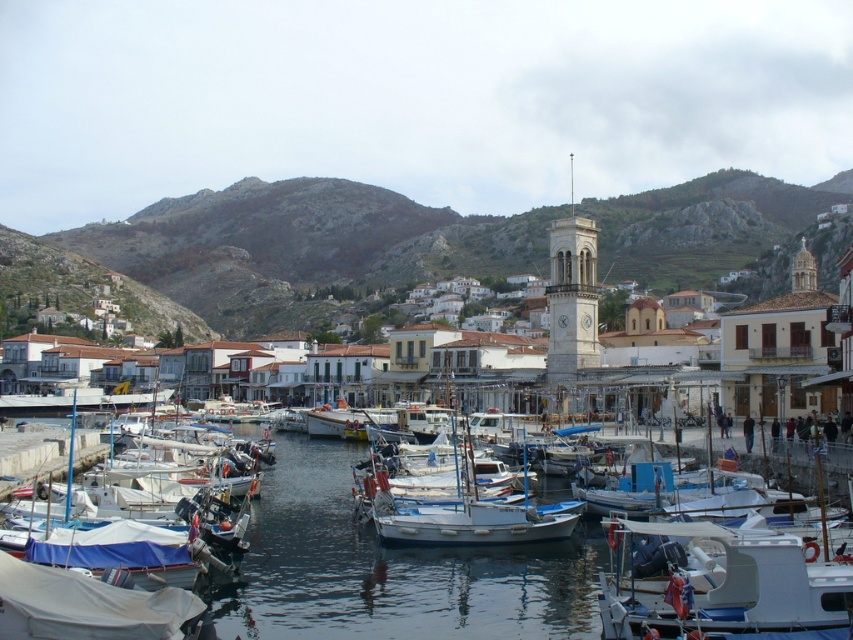
Which is more to the left, white matte buildings at center or white matte boat at center?

From the viewer's perspective, white matte buildings at center appears more on the left side.

Who is more forward, (x=349, y=200) or (x=540, y=524)?

Point (x=540, y=524)

Identify the location of white matte buildings at center. (293, 248).

Is white matte buildings at center below white tarpaulin boat at lower left?

No, white matte buildings at center is not below white tarpaulin boat at lower left.

Image resolution: width=853 pixels, height=640 pixels. Identify the location of white matte buildings at center. (293, 248).

Does white matte boat at lower right come in front of white matte boat at center?

Yes, it is in front of white matte boat at center.

Image resolution: width=853 pixels, height=640 pixels. What do you see at coordinates (718, 582) in the screenshot?
I see `white matte boat at lower right` at bounding box center [718, 582].

Which is in front, point (670, 547) or point (469, 481)?

Positioned in front is point (670, 547).

Identify the location of white matte boat at lower right. [x=718, y=582].